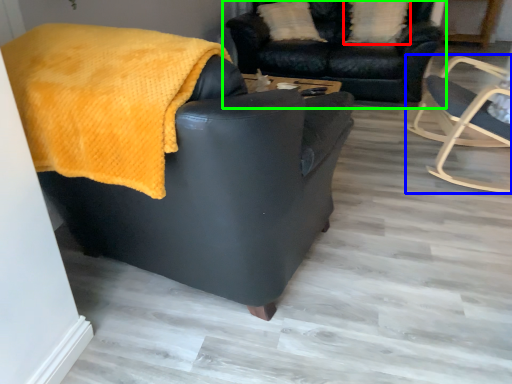
Question: Which object is the farthest from pillow (highlighted by a red box)? Choose among these: chair (highlighted by a blue box) or studio couch (highlighted by a green box).

Choices:
 (A) chair
 (B) studio couch

Answer: (A)